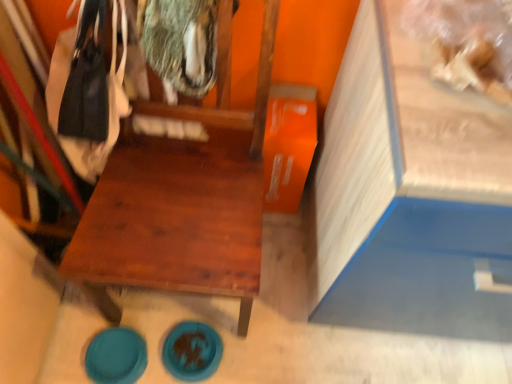
In order to click on vacant area that is situated to the right of wooden chair at center in this screenshot , I will do `click(287, 299)`.